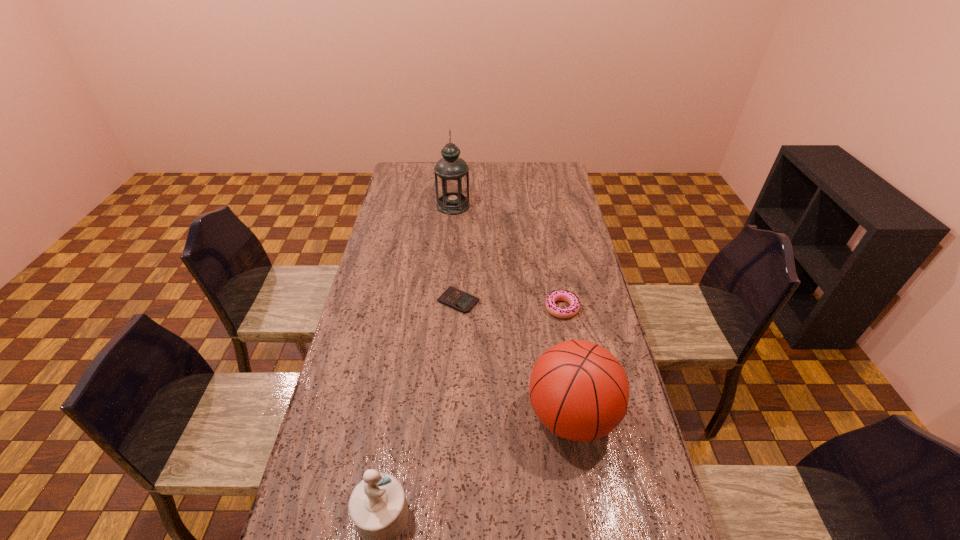
Where is `the farthest object`? The width and height of the screenshot is (960, 540). the farthest object is located at coordinates (451, 173).

Locate an element on the screen. oil lamp is located at coordinates (451, 173).

Locate an element on the screen. the fourth farthest object is located at coordinates pos(578,389).

The image size is (960, 540). I want to click on the fourth shortest object, so click(x=578, y=389).

Find the location of a particular element. The image size is (960, 540). the fourth tallest object is located at coordinates (559, 295).

Image resolution: width=960 pixels, height=540 pixels. What are the coordinates of `the shortest object` in the screenshot? It's located at (461, 301).

You are a GUI agent. You are given a task and a screenshot of the screen. Output one action in this format:
    pyautogui.click(x=<x>, y=<y>)
    Task: Click on the vacant space located 0.230m on the right of the oil lamp
    This screenshot has width=960, height=540.
    Given the screenshot: What is the action you would take?
    pyautogui.click(x=519, y=206)

Identify the location of free space located on the back of the second tallest object. (563, 362).

Image resolution: width=960 pixels, height=540 pixels. I want to click on free spot located on the back of the second shortest object, so click(556, 280).

Find the location of `vacant space located 0.090m on the left of the calculator`. vacant space located 0.090m on the left of the calculator is located at coordinates (412, 301).